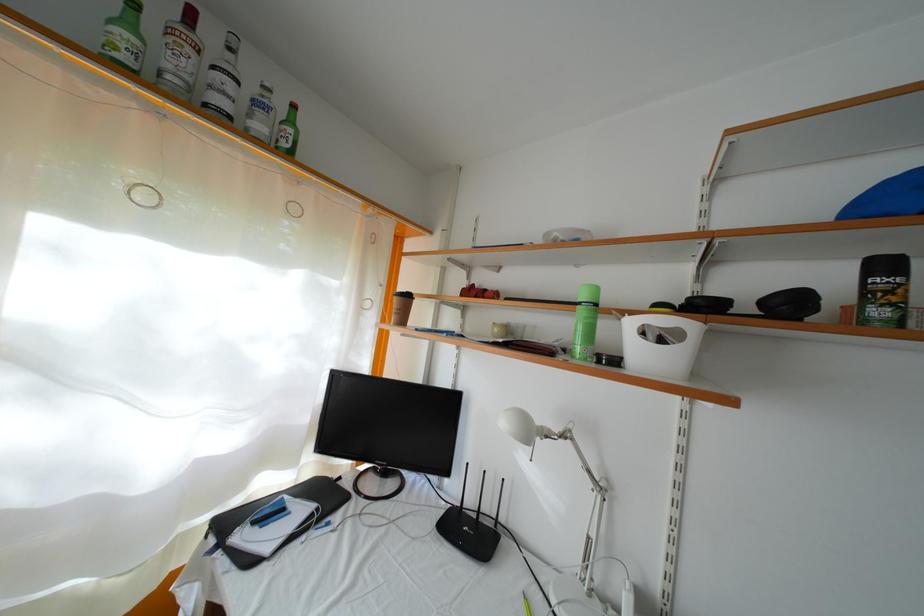
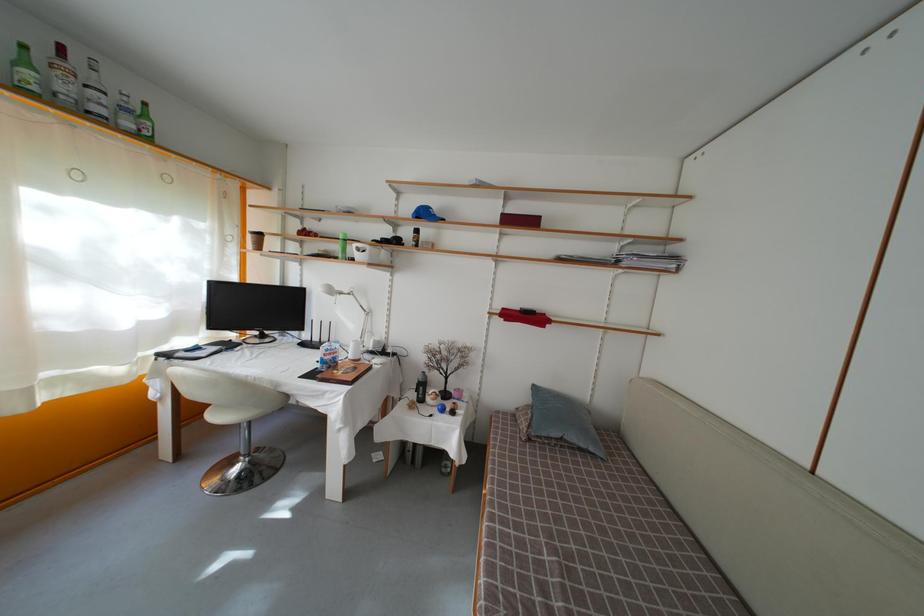
Find the pixel in the second image that matches [134,31] in the first image.

(31, 69)